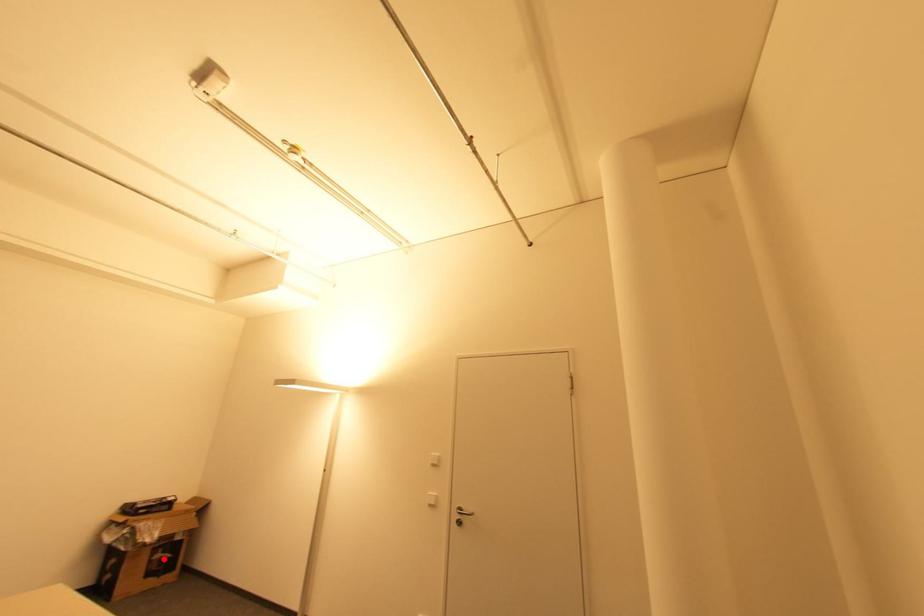
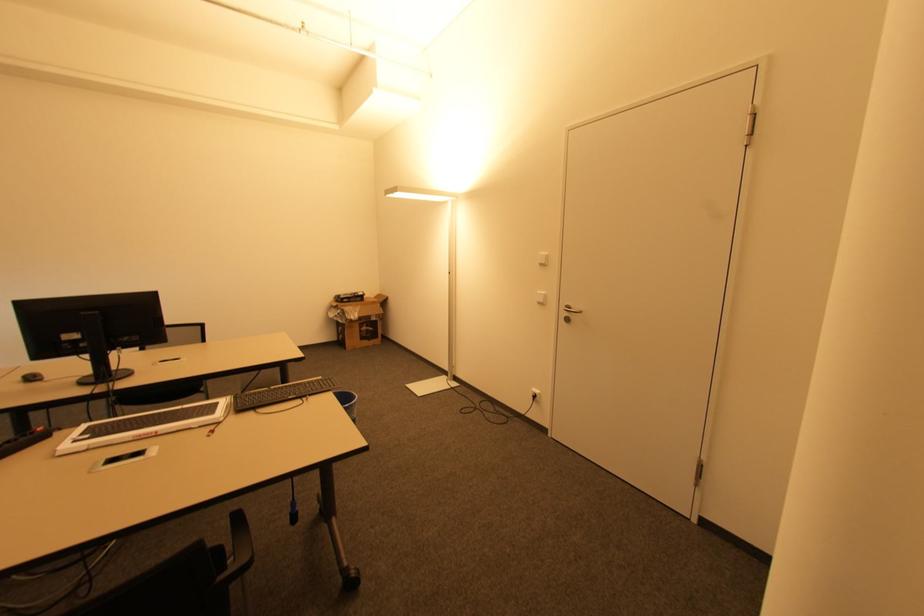
Question: I am providing you with two images of the same scene from different viewpoints. In image1, a red point is highlighted. Considering the same 3D point in image2, which of the following is correct?

Choices:
 (A) It is closer
 (B) It is farther

Answer: (A)